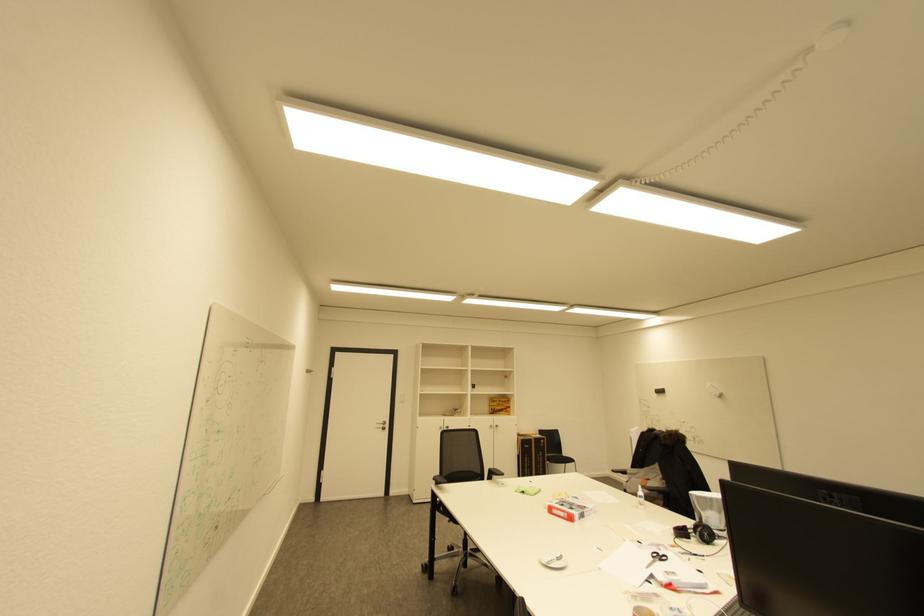
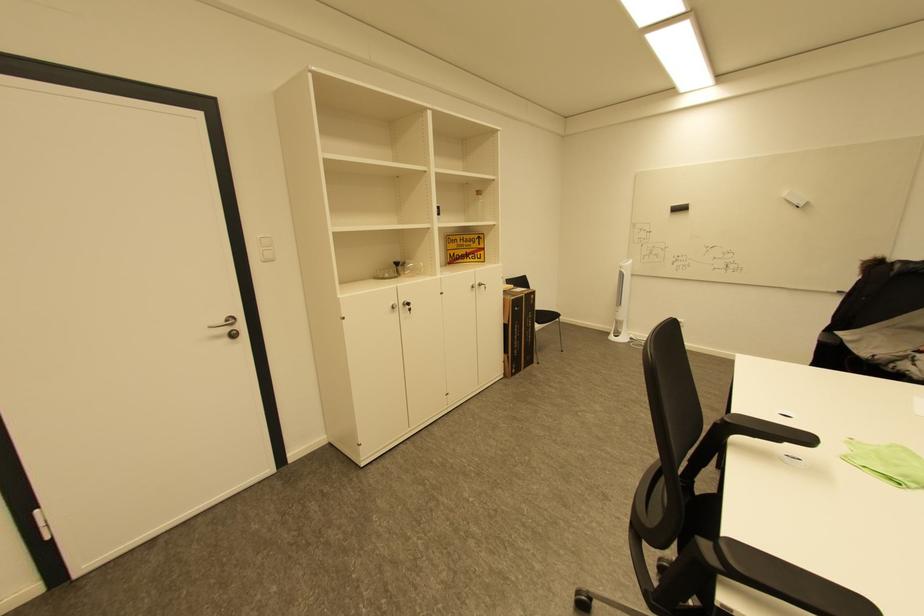
Locate, in the second image, the point that corresponds to [496,427] in the first image.

(479, 286)